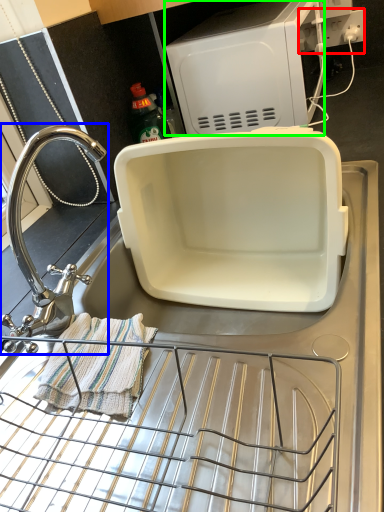
Question: Estimate the real-world distances between objects in this image. Which object is closer to electric outlet (highlighted by a red box), tap (highlighted by a blue box) or appliance (highlighted by a green box)?

Choices:
 (A) tap
 (B) appliance

Answer: (B)